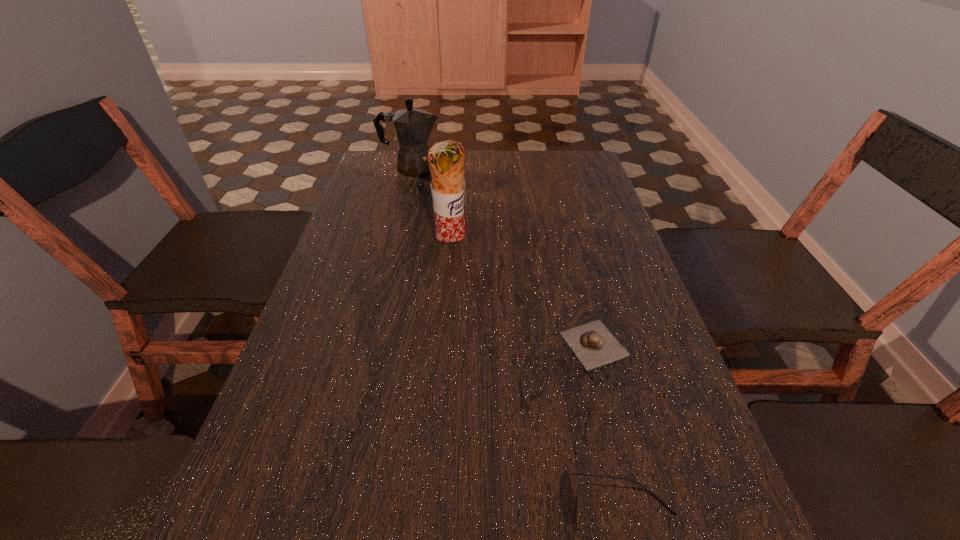
I want to click on object at the left edge, so click(412, 127).

Where is `object present at the right edge`? This screenshot has height=540, width=960. object present at the right edge is located at coordinates (592, 343).

Locate an element on the screen. object at the far left corner is located at coordinates (412, 127).

Locate an element on the screen. The image size is (960, 540). vacant region at the far edge of the desktop is located at coordinates (547, 183).

The width and height of the screenshot is (960, 540). In the image, there is a desktop. In order to click on free region at the left edge in this screenshot , I will do `click(359, 313)`.

Where is `blank area at the right edge`? The image size is (960, 540). blank area at the right edge is located at coordinates point(668,468).

In the image, there is a desktop. Identify the location of free space at the far right corner. The height and width of the screenshot is (540, 960). (550, 157).

Where is `vacant region between the burrito and the shortest object`? This screenshot has height=540, width=960. vacant region between the burrito and the shortest object is located at coordinates (522, 295).

Locate an element on the screen. The height and width of the screenshot is (540, 960). vacant space that is in between the third object from right to left and the leftmost object is located at coordinates (431, 207).

Where is `vacant space that is in between the third nearest object and the shortest object`? vacant space that is in between the third nearest object and the shortest object is located at coordinates (522, 295).